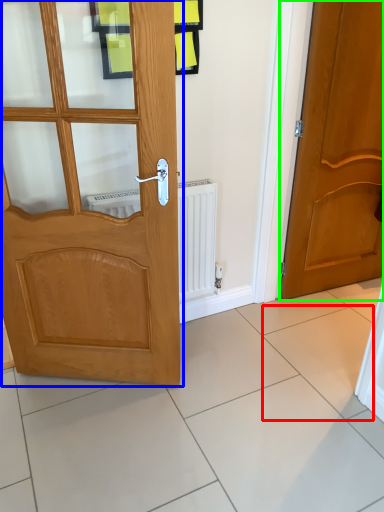
Question: Which is nearer to the ceramic tile (highlighted by a red box)? door (highlighted by a blue box) or door (highlighted by a green box).

Choices:
 (A) door
 (B) door

Answer: (B)